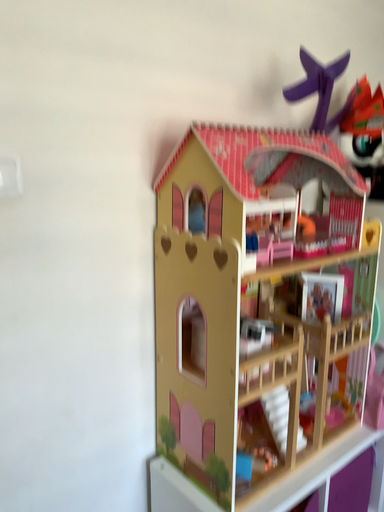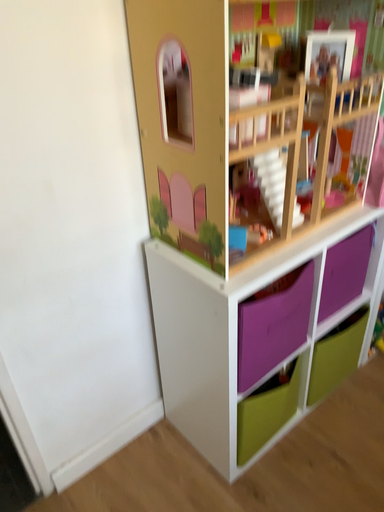
Question: How did the camera likely rotate when shooting the video?

Choices:
 (A) rotated downward
 (B) rotated upward

Answer: (A)